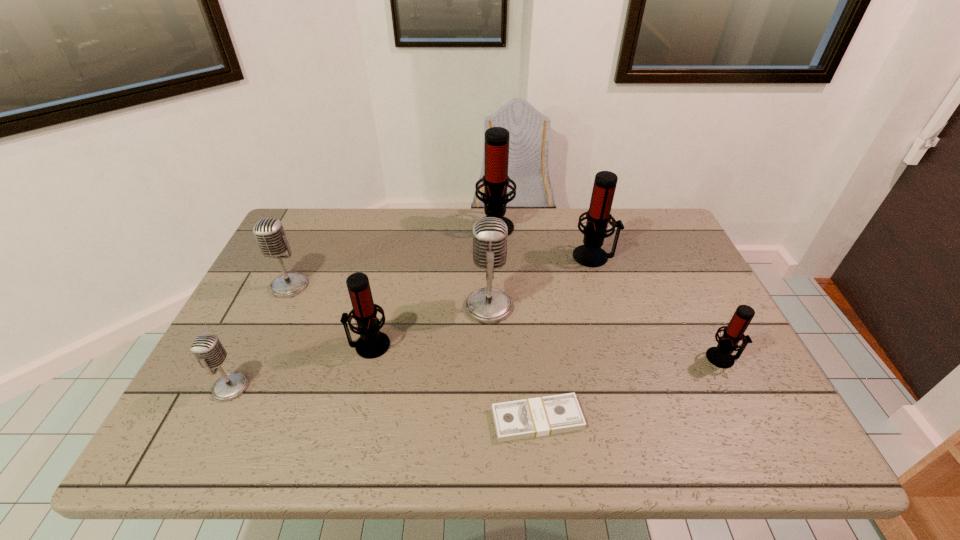
Identify the location of free space located 0.350m on the left of the shortest object. This screenshot has width=960, height=540. (324, 419).

The image size is (960, 540). I want to click on object that is at the near edge, so click(x=541, y=416).

Where is `object that is positioned at the right edge`? object that is positioned at the right edge is located at coordinates click(x=721, y=356).

This screenshot has width=960, height=540. I want to click on free region at the far edge, so click(435, 231).

Where is `free location at the near edge of the desktop`? Image resolution: width=960 pixels, height=540 pixels. free location at the near edge of the desktop is located at coordinates (659, 449).

Where is `vacant position at the left edge of the desktop`? This screenshot has height=540, width=960. vacant position at the left edge of the desktop is located at coordinates (287, 299).

You are a GUI agent. You are given a task and a screenshot of the screen. Output one action in this format:
    pyautogui.click(x=<x>, y=<y>)
    Task: Click on the free space at the right edge
    
    Given the screenshot: What is the action you would take?
    pyautogui.click(x=748, y=413)

This screenshot has width=960, height=540. In the image, there is a desktop. What are the coordinates of `vacant space at the far left corner` in the screenshot? It's located at tap(310, 234).

Where is `vacant space in between the second red microphone from left to right and the rightmost red microphone`? vacant space in between the second red microphone from left to right and the rightmost red microphone is located at coordinates (609, 292).

Locate an element on the screen. This screenshot has height=540, width=960. unoccupied area between the biggest red microphone and the second biggest gray microphone is located at coordinates (393, 255).